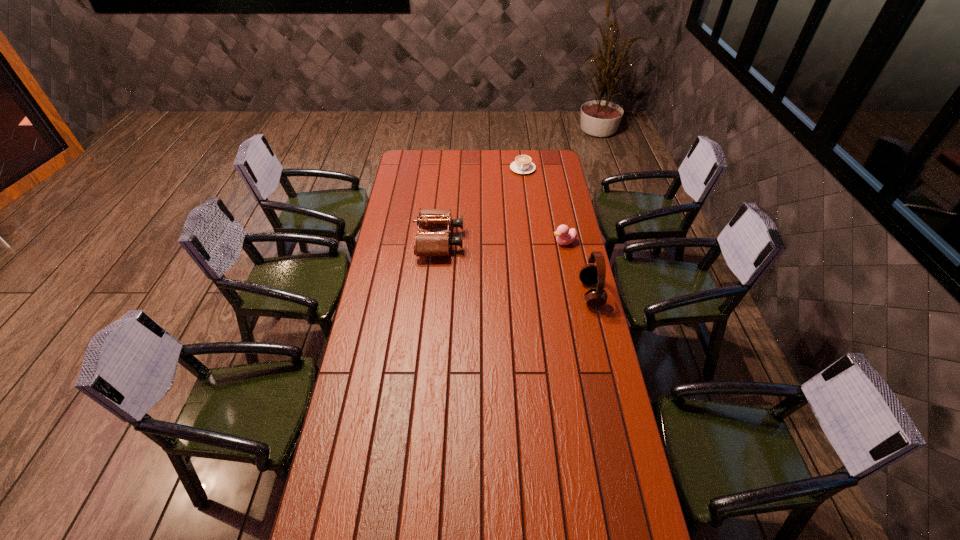
The width and height of the screenshot is (960, 540). I want to click on free spot on the desktop that is between the binoculars and the nearest object and is positioned on the side of the cappuccino with the handle, so click(x=499, y=262).

Where is `free space on the desktop that is between the third shortest object and the headset and is positioned on the front-facing side of the duckling`? Image resolution: width=960 pixels, height=540 pixels. free space on the desktop that is between the third shortest object and the headset and is positioned on the front-facing side of the duckling is located at coordinates (503, 263).